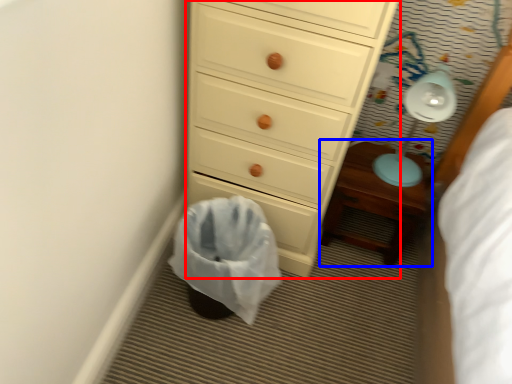
Question: Which of the following is the closest to the observer, chest of drawers (highlighted by a red box) or nightstand (highlighted by a blue box)?

Choices:
 (A) chest of drawers
 (B) nightstand

Answer: (A)